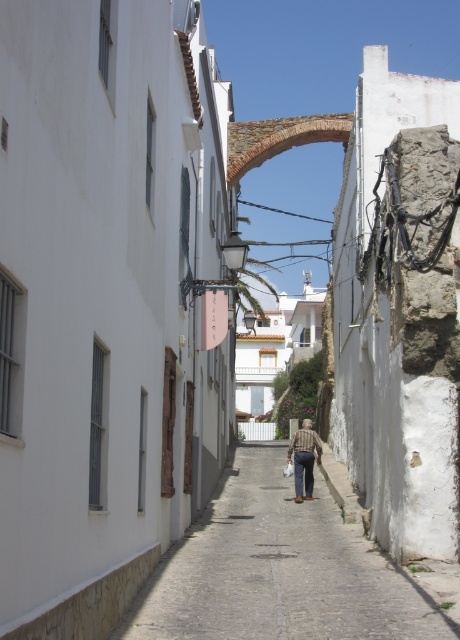
Question: Can you confirm if white painted building at center is wider than brown textured shirt at center?

Choices:
 (A) no
 (B) yes

Answer: (B)

Question: Among these objects, which one is nearest to the camera?

Choices:
 (A) brown textured shirt at center
 (B) white painted building at center

Answer: (A)

Question: Among these objects, which one is nearest to the camera?

Choices:
 (A) brown textured shirt at center
 (B) cobblestone path at center
 (C) white painted building at center

Answer: (B)

Question: Which point is farther to the camera?

Choices:
 (A) (235, 358)
 (B) (241, 467)
 (C) (304, 438)

Answer: (A)

Question: Is white painted building at center behind brown textured shirt at center?

Choices:
 (A) yes
 (B) no

Answer: (A)

Question: Can you confirm if white painted building at center is positioned to the right of brown textured shirt at center?

Choices:
 (A) no
 (B) yes

Answer: (B)